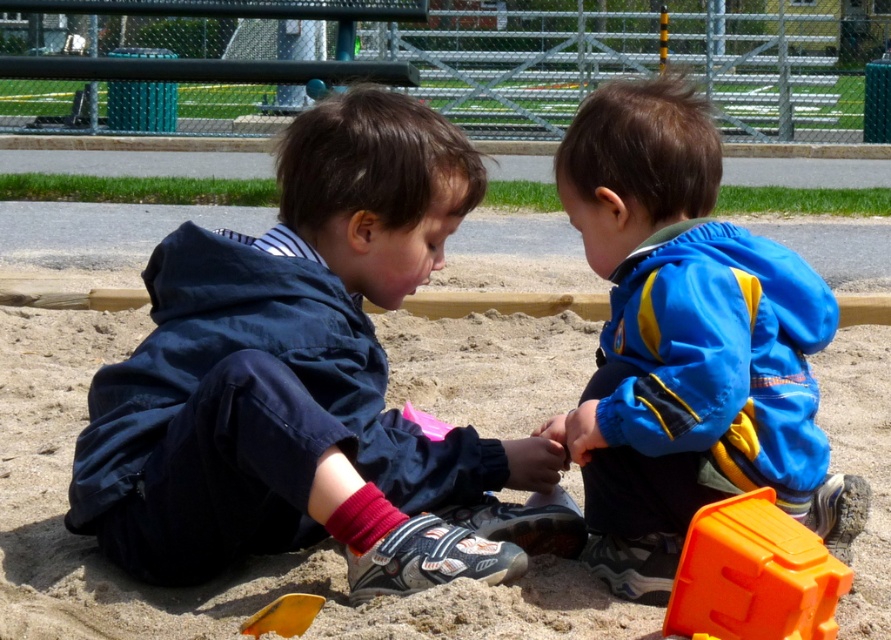
In the scene shown: You are a parent supervising the children at the sandbox. You notice the dark blue jacket at center and the orange plastic toy at lower right. Which object is higher in the image?

The dark blue jacket at center is taller than the orange plastic toy at lower right, so the dark blue jacket at center is higher in the image.

Consider the image. You are a parent standing at the edge of the sandbox. Your child is playing with the orange plastic toy at lower right. If you want to retrieve the toy without moving closer to it, can you reach it from where you are standing?

The orange plastic toy at lower right is 3.16 meters away from camera. Since you are standing at the edge of the sandbox, which is likely the same position as the camera, the distance is too far to reach the toy without moving closer.

You are a parent watching your children play in the sandbox. You notice the dark blue jacket at center and the pink plastic shovel at center. Which object is physically nearer to you?

The dark blue jacket at center is closer to the viewer than the pink plastic shovel at center.